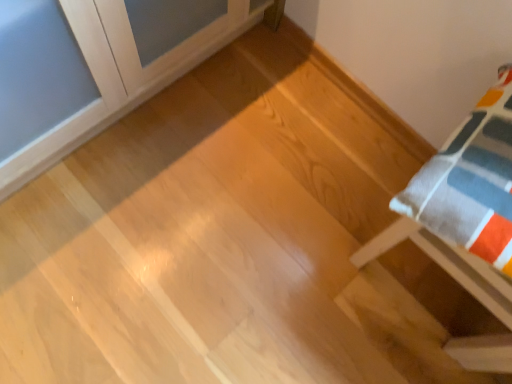
Question: Is light wood floor at upper left, the first furniture in the left-to-right sequence, outside of white cotton pillow at right, which ranks as the second furniture in left-to-right order?

Choices:
 (A) no
 (B) yes

Answer: (B)

Question: Is light wood floor at upper left, the first furniture in the left-to-right sequence, positioned behind white cotton pillow at right, the first furniture positioned from the right?

Choices:
 (A) yes
 (B) no

Answer: (B)

Question: Does light wood floor at upper left, the first furniture in the left-to-right sequence, touch white cotton pillow at right, the first furniture positioned from the right?

Choices:
 (A) no
 (B) yes

Answer: (A)

Question: From a real-world perspective, is light wood floor at upper left, positioned as the second furniture in right-to-left order, physically above white cotton pillow at right, which ranks as the second furniture in left-to-right order?

Choices:
 (A) no
 (B) yes

Answer: (B)

Question: From a real-world perspective, is light wood floor at upper left, the first furniture in the left-to-right sequence, physically below white cotton pillow at right, the first furniture positioned from the right?

Choices:
 (A) yes
 (B) no

Answer: (B)

Question: From the image's perspective, is light wood floor at upper left, positioned as the second furniture in right-to-left order, beneath white cotton pillow at right, the first furniture positioned from the right?

Choices:
 (A) yes
 (B) no

Answer: (B)

Question: Is white cotton pillow at right, which ranks as the second furniture in left-to-right order, at the left side of light wood floor at upper left, the first furniture in the left-to-right sequence?

Choices:
 (A) yes
 (B) no

Answer: (B)

Question: Is white cotton pillow at right, the first furniture positioned from the right, located outside light wood floor at upper left, positioned as the second furniture in right-to-left order?

Choices:
 (A) no
 (B) yes

Answer: (B)

Question: Is white cotton pillow at right, the first furniture positioned from the right, bigger than light wood floor at upper left, the first furniture in the left-to-right sequence?

Choices:
 (A) no
 (B) yes

Answer: (A)

Question: From the image's perspective, would you say white cotton pillow at right, the first furniture positioned from the right, is positioned over light wood floor at upper left, the first furniture in the left-to-right sequence?

Choices:
 (A) no
 (B) yes

Answer: (A)

Question: Does white cotton pillow at right, which ranks as the second furniture in left-to-right order, have a lesser width compared to light wood floor at upper left, the first furniture in the left-to-right sequence?

Choices:
 (A) no
 (B) yes

Answer: (B)

Question: Does white cotton pillow at right, the first furniture positioned from the right, lie behind light wood floor at upper left, the first furniture in the left-to-right sequence?

Choices:
 (A) yes
 (B) no

Answer: (A)

Question: From a real-world perspective, is white cotton pillow at right, which ranks as the second furniture in left-to-right order, physically located above or below light wood floor at upper left, positioned as the second furniture in right-to-left order?

Choices:
 (A) below
 (B) above

Answer: (A)